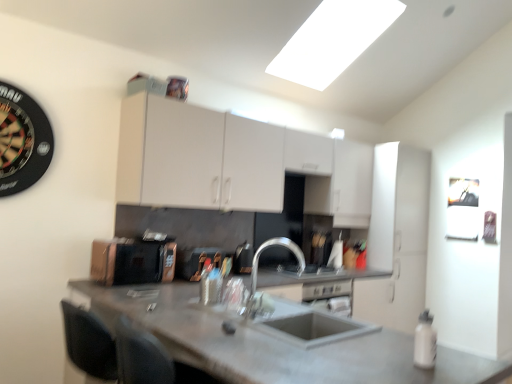
Locate an element on the screen. This screenshot has width=512, height=384. vacant space in front of silver metallic faucet at center is located at coordinates (266, 334).